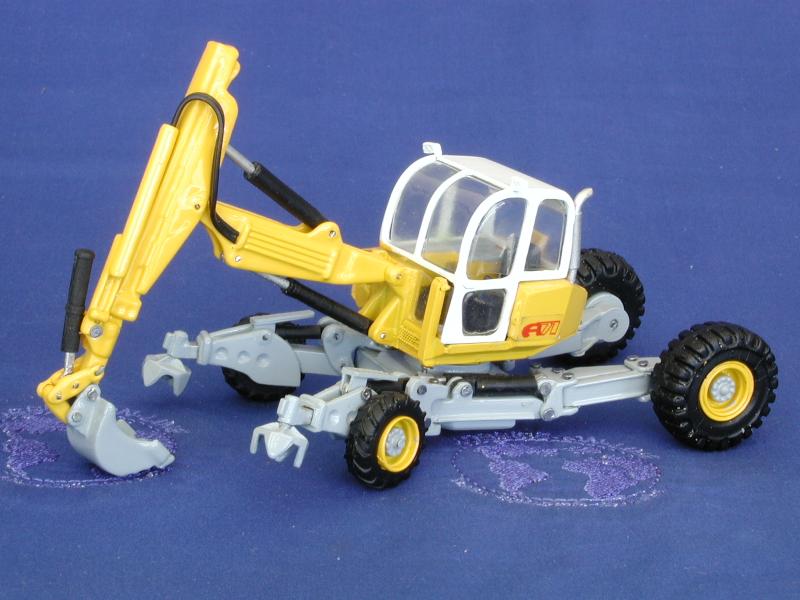
Locate an element on the screen. toy is located at coordinates (446, 287).